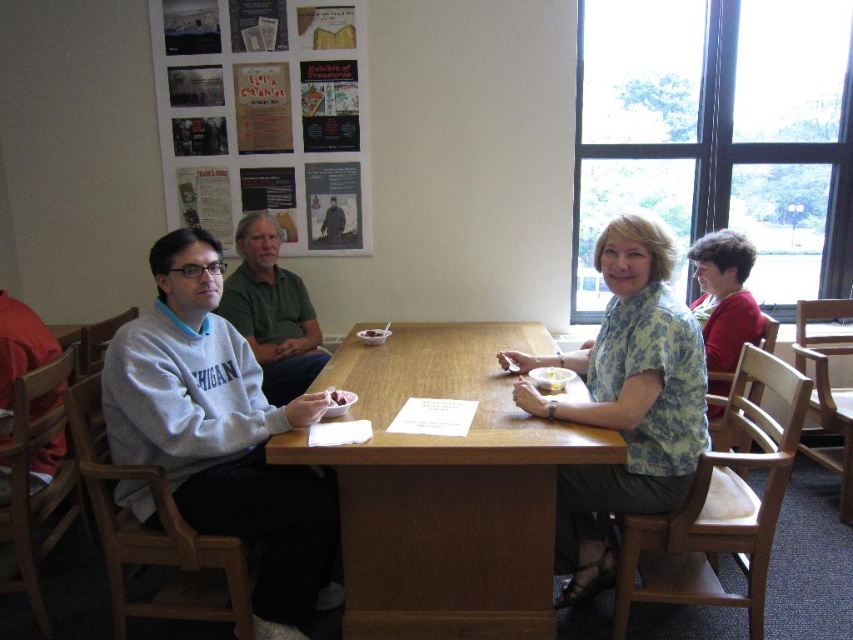
Is gray fleece sweater at left shorter than paper posters at upper left?

In fact, gray fleece sweater at left may be taller than paper posters at upper left.

Does gray fleece sweater at left appear over paper posters at upper left?

No.

Which is in front, point (163, 356) or point (230, 65)?

Positioned in front is point (163, 356).

Where is `gray fleece sweater at left`? The image size is (853, 640). gray fleece sweater at left is located at coordinates (221, 435).

Describe the element at coordinates (262, 115) in the screenshot. I see `paper posters at upper left` at that location.

Who is positioned more to the left, paper posters at upper left or brown matte cookie at center?

paper posters at upper left

Describe the element at coordinates (262, 115) in the screenshot. The height and width of the screenshot is (640, 853). I see `paper posters at upper left` at that location.

Image resolution: width=853 pixels, height=640 pixels. Find the location of `paper posters at upper left`. paper posters at upper left is located at coordinates (262, 115).

Does paper posters at upper left have a larger size compared to matte plastic bowl at center?

Yes, paper posters at upper left is bigger than matte plastic bowl at center.

Does paper posters at upper left have a greater width compared to matte plastic bowl at center?

Indeed, paper posters at upper left has a greater width compared to matte plastic bowl at center.

This screenshot has height=640, width=853. I want to click on paper posters at upper left, so click(262, 115).

At what (x,y) coordinates should I click in order to perform the action: click on paper posters at upper left. Please return your answer as a coordinate pair (x, y). Looking at the image, I should click on (262, 115).